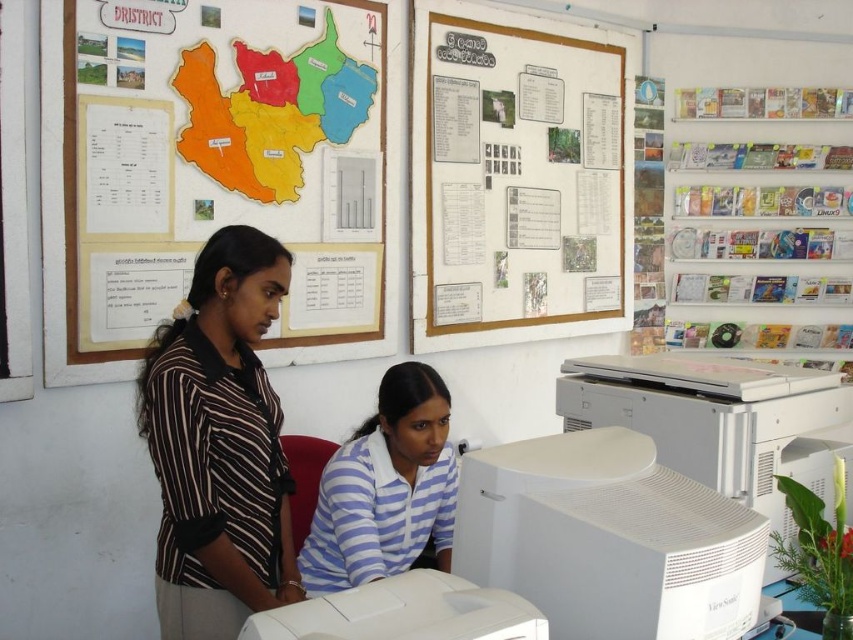
Question: Which of the following is the closest to the observer?

Choices:
 (A) blue striped shirt at center
 (B) white plastic computer monitor at center
 (C) wooden frame at upper center
 (D) striped cotton shirt at center

Answer: (B)

Question: Does wooden frame at upper center have a larger size compared to white plastic printer at lower right?

Choices:
 (A) yes
 (B) no

Answer: (A)

Question: Which object appears closest to the camera in this image?

Choices:
 (A) white plastic computer monitor at center
 (B) blue striped shirt at center
 (C) white plastic printer at lower right
 (D) wooden frame at upper center

Answer: (A)

Question: Can you confirm if white matte computer monitor at lower center is positioned to the left of white plastic printer at lower right?

Choices:
 (A) yes
 (B) no

Answer: (A)

Question: Based on their relative distances, which object is nearer to the white matte computer monitor at lower center?

Choices:
 (A) white plastic computer monitor at center
 (B) white plastic printer at lower right
 (C) wooden frame at upper center

Answer: (A)

Question: Is striped cotton shirt at center positioned behind wooden frame at upper center?

Choices:
 (A) yes
 (B) no

Answer: (B)